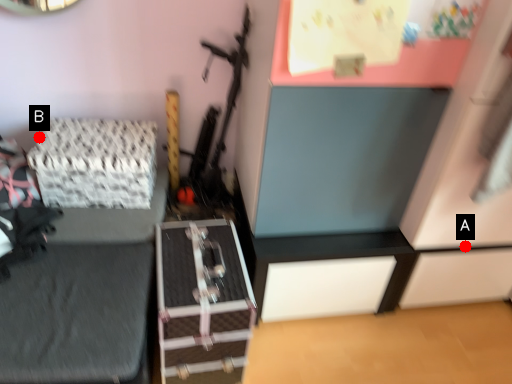
Question: Two points are circled on the image, labeled by A and B beside each circle. Which of the following is the closest to the observer?

Choices:
 (A) A is closer
 (B) B is closer

Answer: (A)